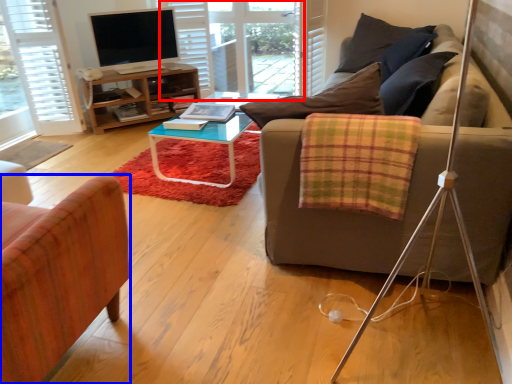
Question: Which of the following is the closest to the observer, glass door (highlighted by a red box) or chair (highlighted by a blue box)?

Choices:
 (A) glass door
 (B) chair

Answer: (B)